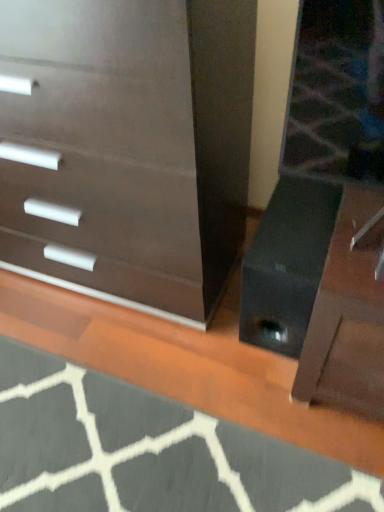
What is the approximate height of gray textured rug at lower center?

It is 4.00 centimeters.

This screenshot has height=512, width=384. I want to click on gray textured rug at lower center, so click(147, 451).

The height and width of the screenshot is (512, 384). What do you see at coordinates (147, 451) in the screenshot?
I see `gray textured rug at lower center` at bounding box center [147, 451].

This screenshot has width=384, height=512. Find the location of `gray textured rug at lower center`. gray textured rug at lower center is located at coordinates pyautogui.click(x=147, y=451).